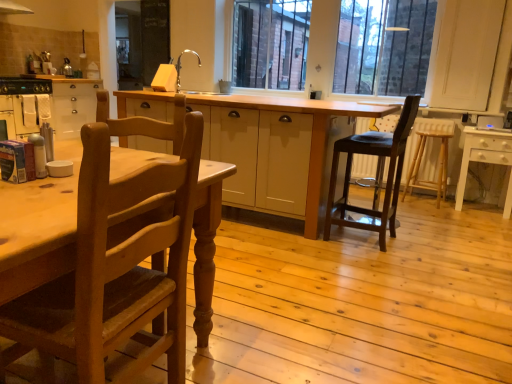
Question: From a real-world perspective, is metallic silver oven at left over silver metallic sink at upper center?

Choices:
 (A) yes
 (B) no

Answer: (B)

Question: From the image's perspective, would you say metallic silver oven at left is shown under silver metallic sink at upper center?

Choices:
 (A) yes
 (B) no

Answer: (A)

Question: Is metallic silver oven at left turned away from silver metallic sink at upper center?

Choices:
 (A) no
 (B) yes

Answer: (A)

Question: Can you confirm if metallic silver oven at left is wider than silver metallic sink at upper center?

Choices:
 (A) yes
 (B) no

Answer: (A)

Question: Is metallic silver oven at left next to silver metallic sink at upper center and touching it?

Choices:
 (A) no
 (B) yes

Answer: (A)

Question: Which is correct: light brown wood chair at left, which is counted as the 2th chair, starting from the back, is inside metallic silver oven at left, or outside of it?

Choices:
 (A) inside
 (B) outside

Answer: (B)

Question: Is point (89, 244) closer or farther from the camera than point (17, 117)?

Choices:
 (A) farther
 (B) closer

Answer: (B)

Question: From the image's perspective, is light brown wood chair at left, which is counted as the 2th chair, starting from the back, above or below metallic silver oven at left?

Choices:
 (A) above
 (B) below

Answer: (B)

Question: From a real-world perspective, is light brown wood chair at left, the second chair in the right-to-left sequence, physically located above or below metallic silver oven at left?

Choices:
 (A) below
 (B) above

Answer: (B)

Question: Would you say light brown wooden bar stool at right is inside or outside silver metallic sink at upper center?

Choices:
 (A) outside
 (B) inside

Answer: (A)

Question: From the image's perspective, relative to silver metallic sink at upper center, is light brown wooden bar stool at right above or below?

Choices:
 (A) above
 (B) below

Answer: (B)

Question: Looking at the image, does light brown wooden bar stool at right seem bigger or smaller compared to silver metallic sink at upper center?

Choices:
 (A) big
 (B) small

Answer: (A)

Question: Is light brown wooden bar stool at right wider or thinner than silver metallic sink at upper center?

Choices:
 (A) thin
 (B) wide

Answer: (B)

Question: From the image's perspective, relative to white glossy table at right, marked as the 1th table in a right-to-left arrangement, is dark brown wood stool at center-right, which appears as the second chair when viewed from the front, above or below?

Choices:
 (A) below
 (B) above

Answer: (A)

Question: Is point (385, 243) positioned closer to the camera than point (510, 152)?

Choices:
 (A) farther
 (B) closer

Answer: (B)